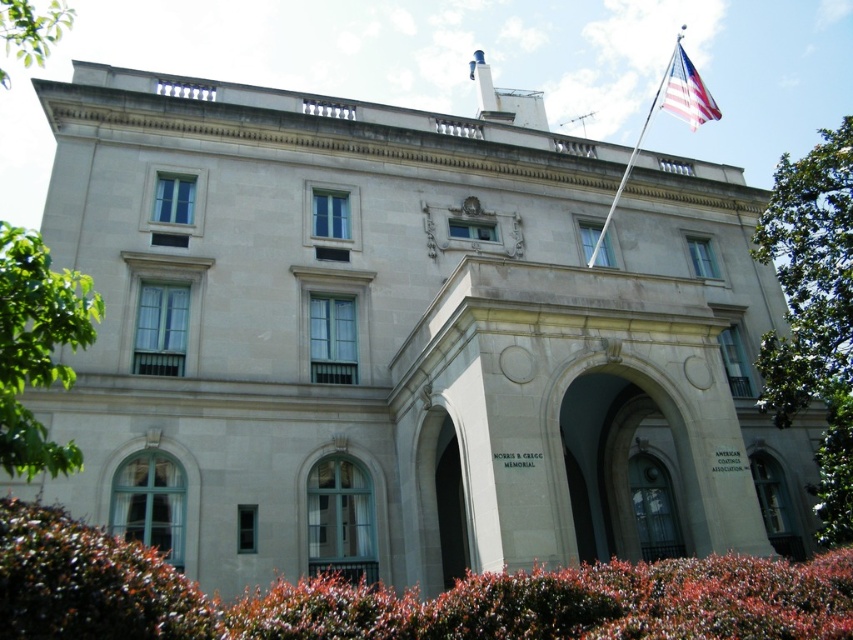
Is green leafy hedge at lower left in front of american flag at upper right?

Yes, it is in front of american flag at upper right.

Does green leafy hedge at lower left appear under american flag at upper right?

Correct, green leafy hedge at lower left is located below american flag at upper right.

Who is more distant from viewer, (x=64, y=624) or (x=688, y=116)?

The point (x=688, y=116) is behind.

I want to click on green leafy hedge at lower left, so click(x=90, y=582).

What do you see at coordinates (813, 312) in the screenshot? I see `green leafy bush at right` at bounding box center [813, 312].

Does green leafy bush at right have a smaller size compared to polished silver flag pole at upper right?

No.

Which is in front, point (790, 186) or point (619, 193)?

Point (790, 186)

Find the location of `green leafy bush at right`. green leafy bush at right is located at coordinates (813, 312).

Which is above, green leafy bush at lower left or american flag at upper right?

american flag at upper right

In order to click on green leafy bush at lower left in this screenshot , I will do `click(38, 348)`.